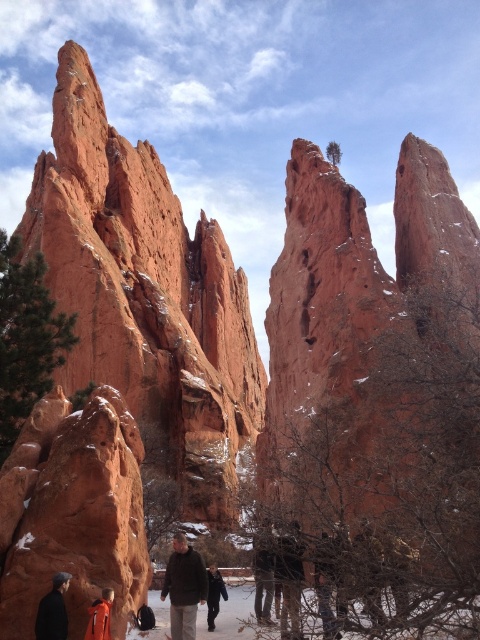
This screenshot has height=640, width=480. I want to click on dark brown leather jacket at center, so click(x=263, y=577).

This screenshot has height=640, width=480. What are the coordinates of `dark brown leather jacket at center` in the screenshot? It's located at (263, 577).

Is brown woolen jacket at center to the left of dark blue jacket at lower center from the viewer's perspective?

Indeed, brown woolen jacket at center is positioned on the left side of dark blue jacket at lower center.

Between brown woolen jacket at center and dark blue jacket at lower center, which one has less height?

With less height is dark blue jacket at lower center.

Who is more forward, (183, 600) or (214, 609)?

Point (183, 600) is in front.

Where is `brown woolen jacket at center`? brown woolen jacket at center is located at coordinates (183, 588).

Which is in front, point (24, 500) or point (190, 577)?

Point (24, 500) is in front.

Looking at this image, between smooth reddish-brown rock at lower left and brown woolen jacket at center, which one appears on the left side from the viewer's perspective?

Positioned to the left is smooth reddish-brown rock at lower left.

At what (x,y) coordinates should I click in order to perform the action: click on smooth reddish-brown rock at lower left. Please return your answer as a coordinate pair (x, y). The height and width of the screenshot is (640, 480). Looking at the image, I should click on (72, 512).